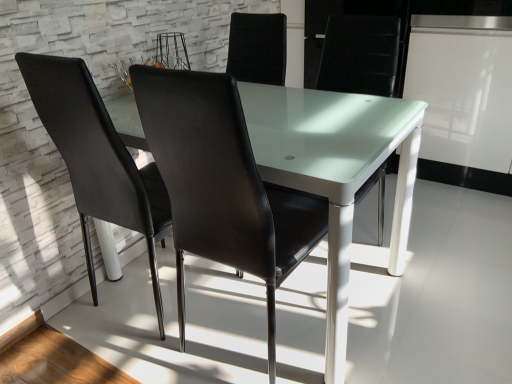
The image size is (512, 384). I want to click on vacant space to the right of transparent glass table at center, so click(x=437, y=269).